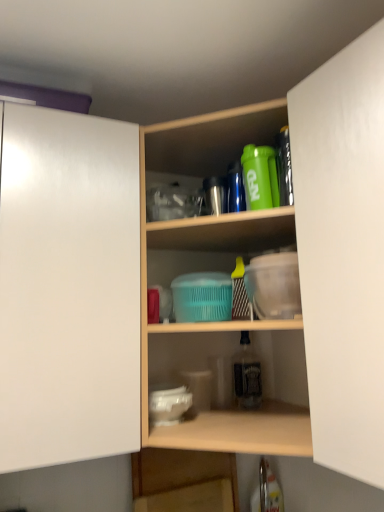
Question: Is white matte cabinet door at left, positioned as the 1th cabinetry in left-to-right order, to the right of green matte shaker at upper center, which is counted as the 1th bottle, starting from the front, from the viewer's perspective?

Choices:
 (A) no
 (B) yes

Answer: (A)

Question: From a real-world perspective, is white matte cabinet door at left, positioned as the 1th cabinetry in left-to-right order, on top of green matte shaker at upper center, the 2th bottle when ordered from bottom to top?

Choices:
 (A) yes
 (B) no

Answer: (B)

Question: From a real-world perspective, is white matte cabinet door at left, marked as the 2th cabinetry in a right-to-left arrangement, located beneath green matte shaker at upper center, which is the first bottle from top to bottom?

Choices:
 (A) yes
 (B) no

Answer: (A)

Question: Is green matte shaker at upper center, placed as the 2th bottle when sorted from back to front, a part of white matte cabinet door at left, marked as the 2th cabinetry in a right-to-left arrangement?

Choices:
 (A) yes
 (B) no

Answer: (B)

Question: Is white matte cabinet door at left, marked as the 2th cabinetry in a right-to-left arrangement, facing away from green matte shaker at upper center, which is counted as the 1th bottle, starting from the front?

Choices:
 (A) yes
 (B) no

Answer: (B)

Question: Is wooden shelves at center, marked as the second shelf in a bottom-to-top arrangement, to the left or to the right of white matte cabinet door at right, the first cabinetry viewed from the right, in the image?

Choices:
 (A) left
 (B) right

Answer: (A)

Question: In terms of width, does wooden shelves at center, marked as the second shelf in a bottom-to-top arrangement, look wider or thinner when compared to white matte cabinet door at right, acting as the second cabinetry starting from the left?

Choices:
 (A) wide
 (B) thin

Answer: (A)

Question: Considering the positions of point (205, 425) and point (299, 248), is point (205, 425) closer or farther from the camera than point (299, 248)?

Choices:
 (A) farther
 (B) closer

Answer: (A)

Question: Based on their sizes in the image, would you say wooden shelves at center, marked as the second shelf in a bottom-to-top arrangement, is bigger or smaller than white matte cabinet door at right, acting as the second cabinetry starting from the left?

Choices:
 (A) small
 (B) big

Answer: (B)

Question: Looking at their shapes, would you say white matte cabinet door at left, marked as the 2th cabinetry in a right-to-left arrangement, is wider or thinner than clear glass bottle at center, the 2th bottle viewed from the top?

Choices:
 (A) thin
 (B) wide

Answer: (B)

Question: From the image's perspective, is white matte cabinet door at left, positioned as the 1th cabinetry in left-to-right order, positioned above or below clear glass bottle at center, marked as the 1th bottle in a bottom-to-top arrangement?

Choices:
 (A) above
 (B) below

Answer: (A)

Question: Does point (66, 208) appear closer or farther from the camera than point (241, 362)?

Choices:
 (A) closer
 (B) farther

Answer: (A)

Question: Which is correct: white matte cabinet door at left, marked as the 2th cabinetry in a right-to-left arrangement, is inside clear glass bottle at center, which is counted as the first bottle, starting from the back, or outside of it?

Choices:
 (A) outside
 (B) inside

Answer: (A)

Question: Would you say green matte shaker at upper center, which is counted as the 1th bottle, starting from the front, is inside or outside clear glass bottle at center, which is counted as the first bottle, starting from the back?

Choices:
 (A) outside
 (B) inside

Answer: (A)

Question: In the image, is green matte shaker at upper center, placed as the 2th bottle when sorted from back to front, positioned in front of or behind clear glass bottle at center, which is counted as the first bottle, starting from the back?

Choices:
 (A) behind
 (B) front

Answer: (B)